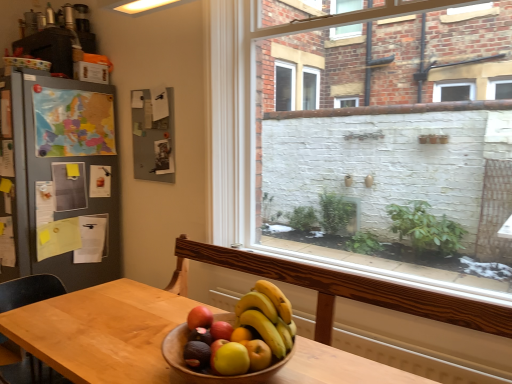
Question: Considering the relative positions of red matte apple at center and wooden bowl at center in the image provided, is red matte apple at center to the left of wooden bowl at center from the viewer's perspective?

Choices:
 (A) yes
 (B) no

Answer: (A)

Question: Is red matte apple at center smaller than wooden bowl at center?

Choices:
 (A) yes
 (B) no

Answer: (A)

Question: Does red matte apple at center have a greater height compared to wooden bowl at center?

Choices:
 (A) yes
 (B) no

Answer: (B)

Question: Is red matte apple at center looking in the opposite direction of wooden bowl at center?

Choices:
 (A) no
 (B) yes

Answer: (B)

Question: Is wooden bowl at center located within red matte apple at center?

Choices:
 (A) no
 (B) yes

Answer: (A)

Question: Is point (291, 352) positioned closer to the camera than point (216, 336)?

Choices:
 (A) farther
 (B) closer

Answer: (A)

Question: Based on their sizes in the image, would you say wooden bowl at center is bigger or smaller than red matte apple at center?

Choices:
 (A) small
 (B) big

Answer: (B)

Question: From a real-world perspective, is wooden bowl at center above or below red matte apple at center?

Choices:
 (A) above
 (B) below

Answer: (B)

Question: Is wooden bowl at center wider or thinner than red matte apple at center?

Choices:
 (A) thin
 (B) wide

Answer: (B)

Question: Is red matte apple at center to the left or to the right of matte black cabinet at upper left in the image?

Choices:
 (A) left
 (B) right

Answer: (B)

Question: Considering the positions of red matte apple at center and matte black cabinet at upper left in the image, is red matte apple at center taller or shorter than matte black cabinet at upper left?

Choices:
 (A) short
 (B) tall

Answer: (A)

Question: In the image, is red matte apple at center positioned in front of or behind matte black cabinet at upper left?

Choices:
 (A) front
 (B) behind

Answer: (A)

Question: Would you say red matte apple at center is inside or outside matte black cabinet at upper left?

Choices:
 (A) inside
 (B) outside

Answer: (B)

Question: From their relative heights in the image, would you say matte black cabinet at upper left is taller or shorter than wooden table at center?

Choices:
 (A) short
 (B) tall

Answer: (A)

Question: Choose the correct answer: Is matte black cabinet at upper left inside wooden table at center or outside it?

Choices:
 (A) inside
 (B) outside

Answer: (B)